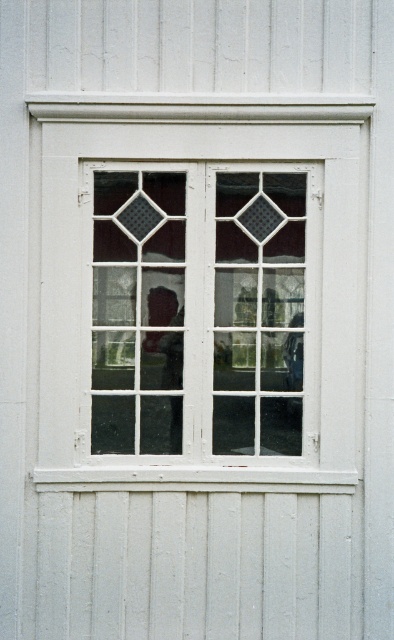
Is white wood window at center to the left of clear glass window at center from the viewer's perspective?

Incorrect, white wood window at center is not on the left side of clear glass window at center.

Can you confirm if white wood window at center is positioned below clear glass window at center?

Incorrect, white wood window at center is not positioned below clear glass window at center.

Find the location of a particular element. white wood window at center is located at coordinates 200,298.